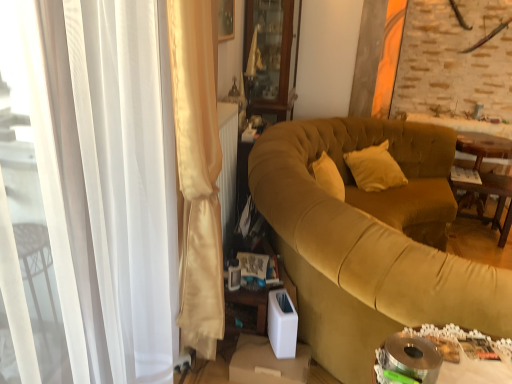
Question: Is the depth of satin white curtain at left greater than that of wooden table at right, arranged as the first table when viewed from the back?

Choices:
 (A) no
 (B) yes

Answer: (A)

Question: Is satin white curtain at left in front of wooden table at right, the third table positioned from the left?

Choices:
 (A) no
 (B) yes

Answer: (B)

Question: Considering the relative sizes of satin white curtain at left and wooden table at right, the third table positioned from the left, in the image provided, is satin white curtain at left shorter than wooden table at right, the third table positioned from the left,?

Choices:
 (A) yes
 (B) no

Answer: (B)

Question: Could you tell me if satin white curtain at left is turned towards wooden table at right, arranged as the first table when viewed from the back?

Choices:
 (A) yes
 (B) no

Answer: (B)

Question: Is satin white curtain at left at the right side of wooden table at right, the third table in the front-to-back sequence?

Choices:
 (A) no
 (B) yes

Answer: (A)

Question: Does satin white curtain at left have a greater height compared to wooden table at right, arranged as the first table when viewed from the back?

Choices:
 (A) no
 (B) yes

Answer: (B)

Question: Is satin white curtain at left positioned beyond the bounds of wooden table at right, marked as the 2th table in a front-to-back arrangement?

Choices:
 (A) no
 (B) yes

Answer: (B)

Question: Is wooden table at right, placed as the second table when sorted from left to right, located within satin white curtain at left?

Choices:
 (A) yes
 (B) no

Answer: (B)

Question: Is satin white curtain at left bigger than wooden table at right, placed as the second table when sorted from left to right?

Choices:
 (A) yes
 (B) no

Answer: (A)

Question: Can you confirm if satin white curtain at left is shorter than wooden table at right, positioned as the 2th table in back-to-front order?

Choices:
 (A) no
 (B) yes

Answer: (A)

Question: Is satin white curtain at left at the right side of wooden table at right, which is the 2th table in right-to-left order?

Choices:
 (A) yes
 (B) no

Answer: (B)

Question: Is satin white curtain at left positioned with its back to wooden table at right, placed as the second table when sorted from left to right?

Choices:
 (A) yes
 (B) no

Answer: (B)

Question: Is wooden cabinet at upper center beside wooden table at right, marked as the 2th table in a front-to-back arrangement?

Choices:
 (A) yes
 (B) no

Answer: (B)